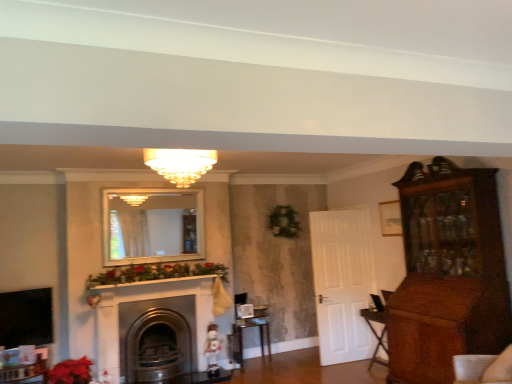
Question: Considering the relative positions of matte glass chandelier at center and metallic silver table at center in the image provided, is matte glass chandelier at center in front of metallic silver table at center?

Choices:
 (A) no
 (B) yes

Answer: (B)

Question: From the image's perspective, is matte glass chandelier at center on top of metallic silver table at center?

Choices:
 (A) no
 (B) yes

Answer: (B)

Question: From a real-world perspective, is matte glass chandelier at center on top of metallic silver table at center?

Choices:
 (A) no
 (B) yes

Answer: (B)

Question: Is metallic silver table at center surrounded by matte glass chandelier at center?

Choices:
 (A) no
 (B) yes

Answer: (A)

Question: Is matte glass chandelier at center further to the viewer compared to metallic silver table at center?

Choices:
 (A) yes
 (B) no

Answer: (B)

Question: Is matte glass chandelier at center outside of metallic silver table at center?

Choices:
 (A) yes
 (B) no

Answer: (A)

Question: Can you confirm if matte glass chandelier at center is positioned to the left of metallic gold fireplace at center?

Choices:
 (A) no
 (B) yes

Answer: (A)

Question: Does matte glass chandelier at center turn towards metallic gold fireplace at center?

Choices:
 (A) no
 (B) yes

Answer: (A)

Question: From the image's perspective, would you say matte glass chandelier at center is positioned over metallic gold fireplace at center?

Choices:
 (A) no
 (B) yes

Answer: (B)

Question: Are matte glass chandelier at center and metallic gold fireplace at center making contact?

Choices:
 (A) no
 (B) yes

Answer: (A)

Question: Are matte glass chandelier at center and metallic gold fireplace at center far apart?

Choices:
 (A) no
 (B) yes

Answer: (B)

Question: Would you say matte glass chandelier at center is outside metallic gold fireplace at center?

Choices:
 (A) no
 (B) yes

Answer: (B)

Question: Can you confirm if matte glass chandelier at center is thinner than vivid red petals at lower left?

Choices:
 (A) yes
 (B) no

Answer: (B)